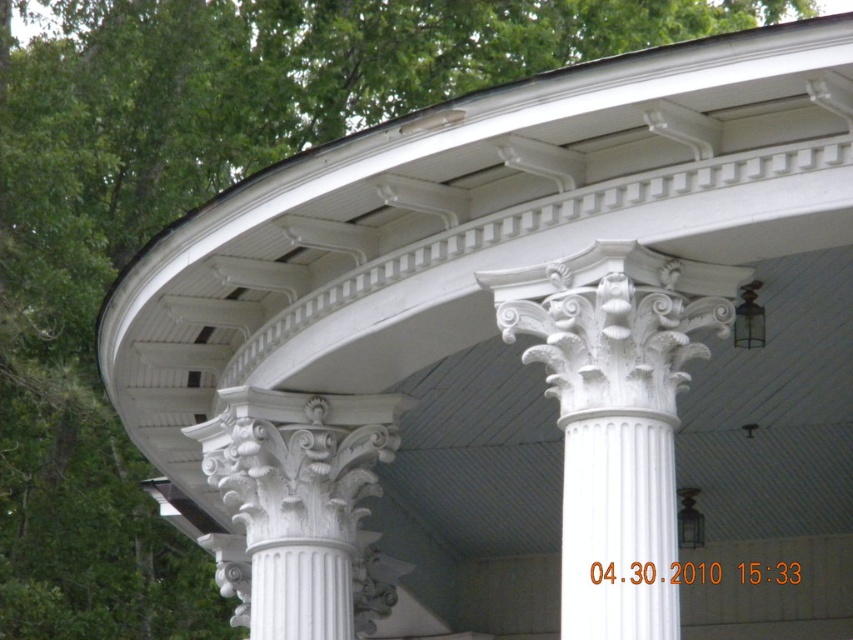
Question: Which of the following is the farthest from the observer?

Choices:
 (A) white marble column at center
 (B) white textured column at center

Answer: (B)

Question: Which of the following is the closest to the observer?

Choices:
 (A) white marble column at center
 (B) white textured column at center

Answer: (A)

Question: Is white marble column at center smaller than white textured column at center?

Choices:
 (A) no
 (B) yes

Answer: (B)

Question: Can you confirm if white marble column at center is wider than white textured column at center?

Choices:
 (A) no
 (B) yes

Answer: (A)

Question: Is white marble column at center further to camera compared to white textured column at center?

Choices:
 (A) yes
 (B) no

Answer: (B)